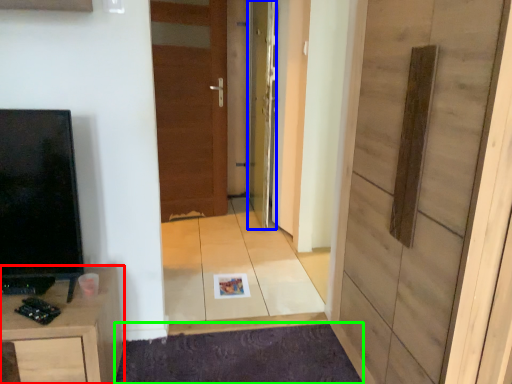
Question: Which is nearer to the cabinetry (highlighted by a red box)? door (highlighted by a blue box) or doormat (highlighted by a green box).

Choices:
 (A) door
 (B) doormat

Answer: (B)